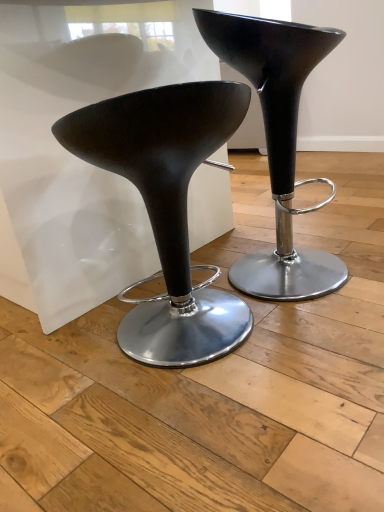
Measure the distance between glossy black stool at center, arranged as the second stool when viewed from the left, and camera.

The distance of glossy black stool at center, arranged as the second stool when viewed from the left, from camera is 91.21 centimeters.

How much space does glossy black stool at center, arranged as the second stool when viewed from the left, occupy vertically?

glossy black stool at center, arranged as the second stool when viewed from the left, is 31.31 inches tall.

What do you see at coordinates (277, 143) in the screenshot?
I see `glossy black stool at center, the 1th stool from the right` at bounding box center [277, 143].

At what (x,y) coordinates should I click in order to perform the action: click on glossy black stool at center, the 1th stool from the right. Please return your answer as a coordinate pair (x, y). Looking at the image, I should click on (277, 143).

Locate an element on the screen. This screenshot has height=512, width=384. matte black stool at center, the second stool from the right is located at coordinates (167, 208).

The height and width of the screenshot is (512, 384). What do you see at coordinates (167, 208) in the screenshot? I see `matte black stool at center, placed as the 1th stool when sorted from left to right` at bounding box center [167, 208].

You are a GUI agent. You are given a task and a screenshot of the screen. Output one action in this format:
    pyautogui.click(x=<x>, y=<y>)
    Task: Click on the glossy black stool at center, the 1th stool from the right
    
    Given the screenshot: What is the action you would take?
    pyautogui.click(x=277, y=143)

Between matte black stool at center, the second stool from the right, and glossy black stool at center, the 1th stool from the right, which one appears on the right side from the viewer's perspective?

glossy black stool at center, the 1th stool from the right.

Is the position of matte black stool at center, the second stool from the right, less distant than that of glossy black stool at center, arranged as the second stool when viewed from the left?

Yes, matte black stool at center, the second stool from the right, is in front of glossy black stool at center, arranged as the second stool when viewed from the left.

Which is more distant, (x=167, y=170) or (x=274, y=147)?

Positioned behind is point (x=274, y=147).

From the image's perspective, which is below, matte black stool at center, the second stool from the right, or glossy black stool at center, the 1th stool from the right?

matte black stool at center, the second stool from the right.

From a real-world perspective, is matte black stool at center, placed as the 1th stool when sorted from left to right, physically below glossy black stool at center, arranged as the second stool when viewed from the left?

Yes, from a real-world perspective, matte black stool at center, placed as the 1th stool when sorted from left to right, is under glossy black stool at center, arranged as the second stool when viewed from the left.

Can you confirm if matte black stool at center, the second stool from the right, is thinner than glossy black stool at center, the 1th stool from the right?

Indeed, matte black stool at center, the second stool from the right, has a lesser width compared to glossy black stool at center, the 1th stool from the right.

Can you confirm if matte black stool at center, the second stool from the right, is shorter than glossy black stool at center, arranged as the second stool when viewed from the left?

Yes.

Between matte black stool at center, the second stool from the right, and glossy black stool at center, the 1th stool from the right, which one has smaller size?

matte black stool at center, the second stool from the right, is smaller.

Is matte black stool at center, the second stool from the right, completely or partially outside of glossy black stool at center, the 1th stool from the right?

Yes.

Is matte black stool at center, placed as the 1th stool when sorted from left to right, with glossy black stool at center, arranged as the second stool when viewed from the left?

matte black stool at center, placed as the 1th stool when sorted from left to right, and glossy black stool at center, arranged as the second stool when viewed from the left, are clearly separated.

Could you tell me if matte black stool at center, placed as the 1th stool when sorted from left to right, is facing glossy black stool at center, arranged as the second stool when viewed from the left?

No, matte black stool at center, placed as the 1th stool when sorted from left to right, is not facing towards glossy black stool at center, arranged as the second stool when viewed from the left.

How different are the orientations of matte black stool at center, the second stool from the right, and glossy black stool at center, the 1th stool from the right, in degrees?

110 degrees.

Measure the distance between matte black stool at center, placed as the 1th stool when sorted from left to right, and glossy black stool at center, arranged as the second stool when viewed from the left.

matte black stool at center, placed as the 1th stool when sorted from left to right, is 26.70 centimeters away from glossy black stool at center, arranged as the second stool when viewed from the left.

Locate an element on the screen. stool behind the matte black stool at center, placed as the 1th stool when sorted from left to right is located at coordinates (277, 143).

Which object is positioned more to the left, glossy black stool at center, the 1th stool from the right, or matte black stool at center, placed as the 1th stool when sorted from left to right?

matte black stool at center, placed as the 1th stool when sorted from left to right, is more to the left.

Which is behind, glossy black stool at center, the 1th stool from the right, or matte black stool at center, placed as the 1th stool when sorted from left to right?

glossy black stool at center, the 1th stool from the right.

Considering the positions of point (266, 262) and point (170, 181), is point (266, 262) closer or farther from the camera than point (170, 181)?

Point (266, 262) is farther from the camera than point (170, 181).

From the image's perspective, is glossy black stool at center, arranged as the second stool when viewed from the left, under matte black stool at center, the second stool from the right?

Incorrect, from the image's perspective, glossy black stool at center, arranged as the second stool when viewed from the left, is higher than matte black stool at center, the second stool from the right.

From a real-world perspective, is glossy black stool at center, the 1th stool from the right, physically located above or below matte black stool at center, the second stool from the right?

From a real-world perspective, glossy black stool at center, the 1th stool from the right, is physically above matte black stool at center, the second stool from the right.

Considering the relative sizes of glossy black stool at center, the 1th stool from the right, and matte black stool at center, the second stool from the right, in the image provided, is glossy black stool at center, the 1th stool from the right, wider than matte black stool at center, the second stool from the right,?

Yes.

Considering the relative sizes of glossy black stool at center, arranged as the second stool when viewed from the left, and matte black stool at center, the second stool from the right, in the image provided, is glossy black stool at center, arranged as the second stool when viewed from the left, taller than matte black stool at center, the second stool from the right,?

Indeed, glossy black stool at center, arranged as the second stool when viewed from the left, has a greater height compared to matte black stool at center, the second stool from the right.

Based on their sizes in the image, would you say glossy black stool at center, the 1th stool from the right, is bigger or smaller than matte black stool at center, the second stool from the right?

Considering their sizes, glossy black stool at center, the 1th stool from the right, takes up more space than matte black stool at center, the second stool from the right.

Can we say glossy black stool at center, the 1th stool from the right, lies outside matte black stool at center, the second stool from the right?

Yes, glossy black stool at center, the 1th stool from the right, is outside of matte black stool at center, the second stool from the right.

Is glossy black stool at center, the 1th stool from the right, beside matte black stool at center, the second stool from the right?

No, glossy black stool at center, the 1th stool from the right, is not in contact with matte black stool at center, the second stool from the right.

Could you tell me if glossy black stool at center, the 1th stool from the right, is turned towards matte black stool at center, the second stool from the right?

No, glossy black stool at center, the 1th stool from the right, is not facing towards matte black stool at center, the second stool from the right.

Measure the distance from glossy black stool at center, arranged as the second stool when viewed from the left, to matte black stool at center, placed as the 1th stool when sorted from left to right.

26.70 centimeters.

There is a matte black stool at center, the second stool from the right. Identify the location of stool above it (from a real-world perspective). This screenshot has width=384, height=512. (277, 143).

Find the location of a particular element. The image size is (384, 512). stool in front of the glossy black stool at center, arranged as the second stool when viewed from the left is located at coordinates pyautogui.click(x=167, y=208).

In order to click on stool to the left of glossy black stool at center, the 1th stool from the right in this screenshot , I will do `click(167, 208)`.